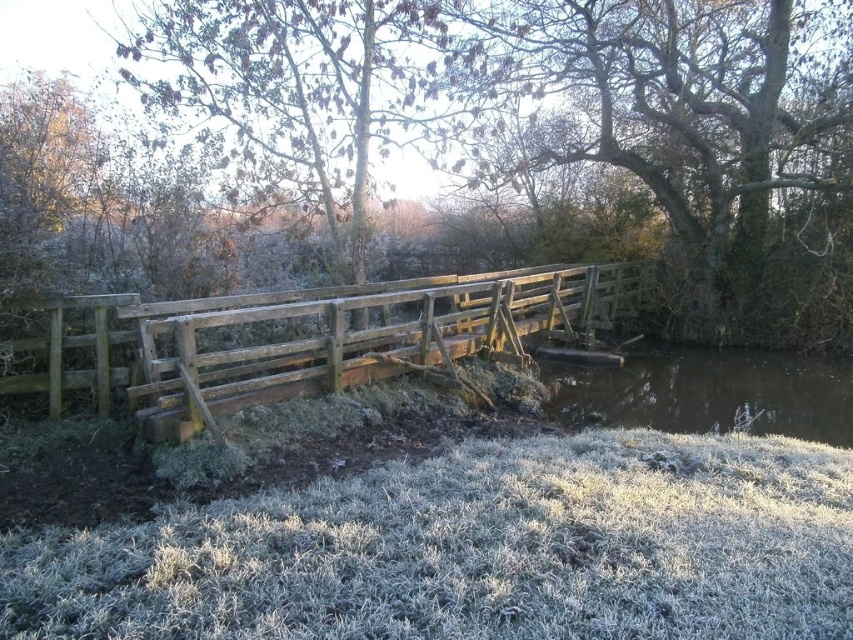
Which is above, frosted grass at lower center or smooth bark tree at center?

smooth bark tree at center is above.

Is frosted grass at lower center to the right of smooth bark tree at center from the viewer's perspective?

No, frosted grass at lower center is not to the right of smooth bark tree at center.

The height and width of the screenshot is (640, 853). What are the coordinates of `frosted grass at lower center` in the screenshot? It's located at (473, 550).

You are a GUI agent. You are given a task and a screenshot of the screen. Output one action in this format:
    pyautogui.click(x=<x>, y=<y>)
    Task: Click on the frosted grass at lower center
    The height and width of the screenshot is (640, 853).
    Given the screenshot: What is the action you would take?
    pyautogui.click(x=473, y=550)

Does frosted grass at lower center have a greater width compared to brown/rough water at lower center?

Yes.

Is frosted grass at lower center behind brown/rough water at lower center?

No, frosted grass at lower center is in front of brown/rough water at lower center.

At what (x,y) coordinates should I click in order to perform the action: click on frosted grass at lower center. Please return your answer as a coordinate pair (x, y). The image size is (853, 640). Looking at the image, I should click on (473, 550).

Identify the location of frosted grass at lower center. The width and height of the screenshot is (853, 640). (473, 550).

In the scene shown: Between weathered wood bridge at center and brown/rough water at lower center, which one appears on the right side from the viewer's perspective?

brown/rough water at lower center is more to the right.

Can you confirm if weathered wood bridge at center is wider than brown/rough water at lower center?

No, weathered wood bridge at center is not wider than brown/rough water at lower center.

Does point (410, 321) lie behind point (764, 433)?

That is True.

Identify the location of weathered wood bridge at center. This screenshot has width=853, height=640. (314, 339).